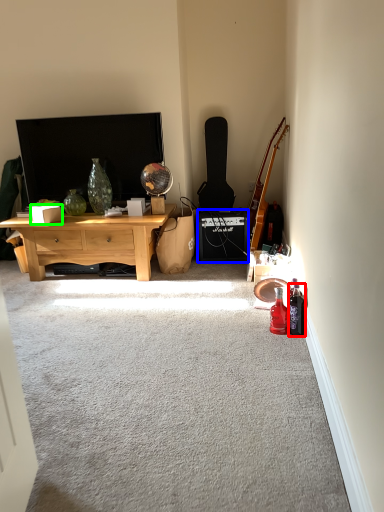
Question: Based on their relative distances, which object is nearer to bottle (highlighted by a red box)? Choose from loudspeaker (highlighted by a blue box) and box (highlighted by a green box).

Choices:
 (A) loudspeaker
 (B) box

Answer: (A)